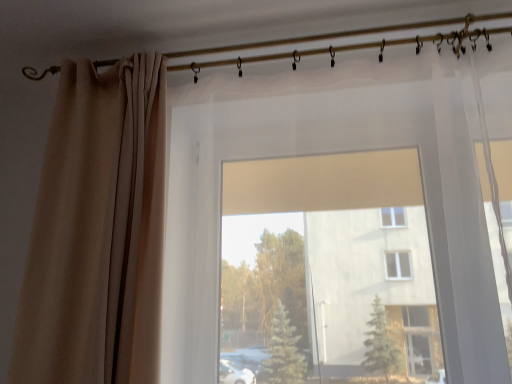
Question: Does point (323, 36) appear closer or farther from the camera than point (74, 160)?

Choices:
 (A) closer
 (B) farther

Answer: (B)

Question: In terms of size, does metallic curtain rod at upper center appear bigger or smaller than beige fabric curtain at left?

Choices:
 (A) big
 (B) small

Answer: (B)

Question: Visually, is metallic curtain rod at upper center positioned to the left or to the right of beige fabric curtain at left?

Choices:
 (A) left
 (B) right

Answer: (B)

Question: From a real-world perspective, is beige fabric curtain at left above or below metallic curtain rod at upper center?

Choices:
 (A) below
 (B) above

Answer: (A)

Question: From the image's perspective, relative to metallic curtain rod at upper center, is beige fabric curtain at left above or below?

Choices:
 (A) below
 (B) above

Answer: (A)

Question: Considering the positions of beige fabric curtain at left and metallic curtain rod at upper center in the image, is beige fabric curtain at left taller or shorter than metallic curtain rod at upper center?

Choices:
 (A) short
 (B) tall

Answer: (B)

Question: Is point (61, 253) closer or farther from the camera than point (287, 54)?

Choices:
 (A) farther
 (B) closer

Answer: (B)